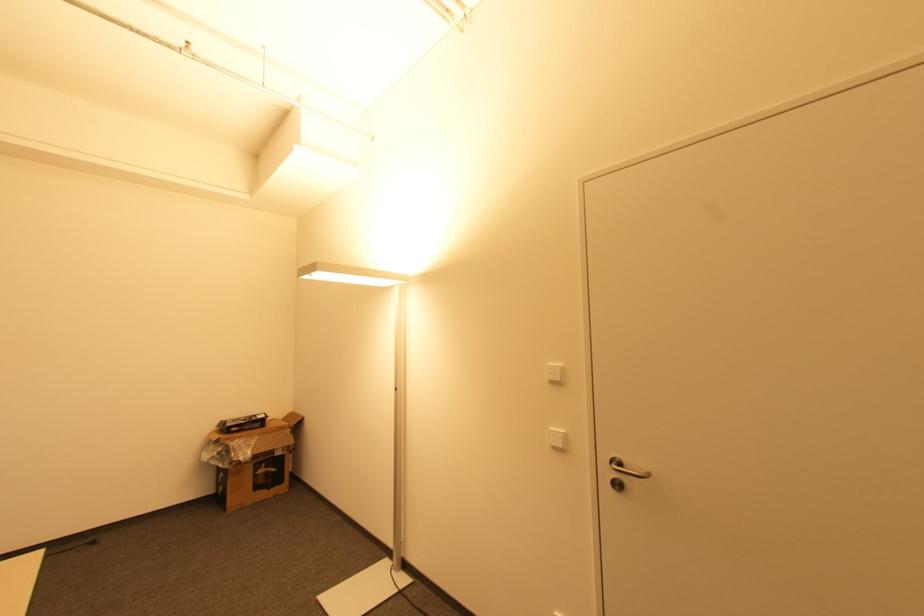
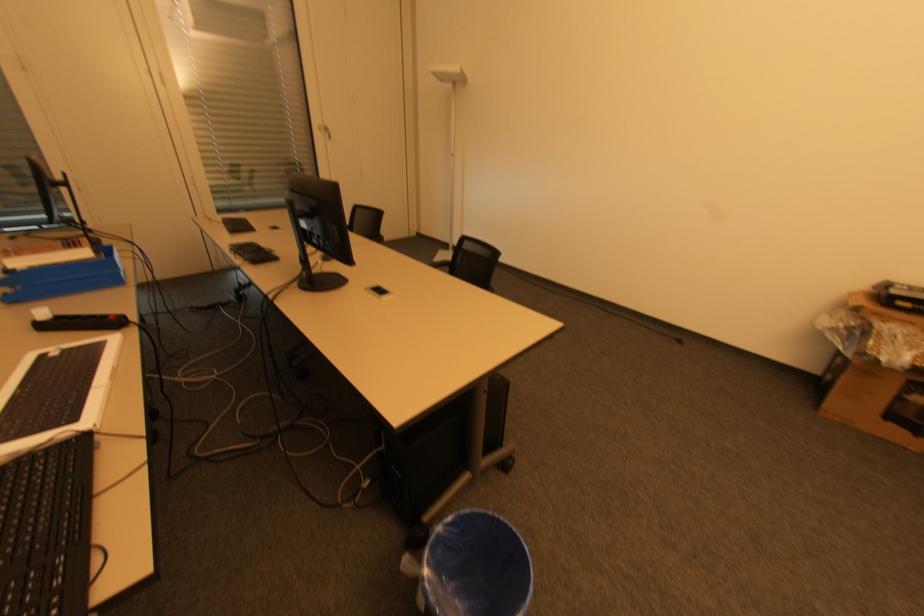
Find the pixel in the second image that matches point 221,453 in the first image.

(850, 328)